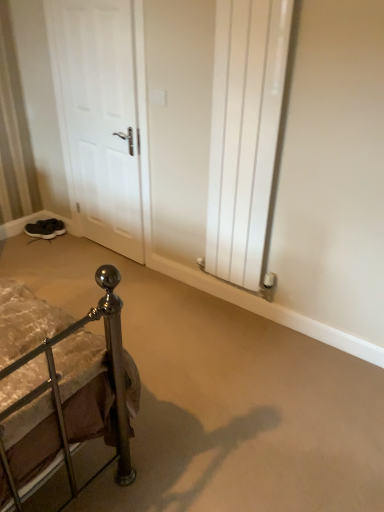
Question: Does point (54, 225) appear closer or farther from the camera than point (125, 62)?

Choices:
 (A) farther
 (B) closer

Answer: (A)

Question: From the image's perspective, is black suede shoes at lower left, which is the first footwear from back to front, positioned above or below white matte door at left?

Choices:
 (A) above
 (B) below

Answer: (B)

Question: Considering the real-world distances, which object is closest to the black suede shoes at lower left, the 2th footwear in the front-to-back sequence?

Choices:
 (A) dark gray suede sneakers at lower left, the 1th footwear in the front-to-back sequence
 (B) white matte door at left
 (C) white glossy radiator at center right

Answer: (A)

Question: Which object is positioned farthest from the white matte door at left?

Choices:
 (A) black suede shoes at lower left, which is the first footwear from back to front
 (B) dark gray suede sneakers at lower left, which appears as the 2th footwear when viewed from the back
 (C) white glossy radiator at center right

Answer: (B)